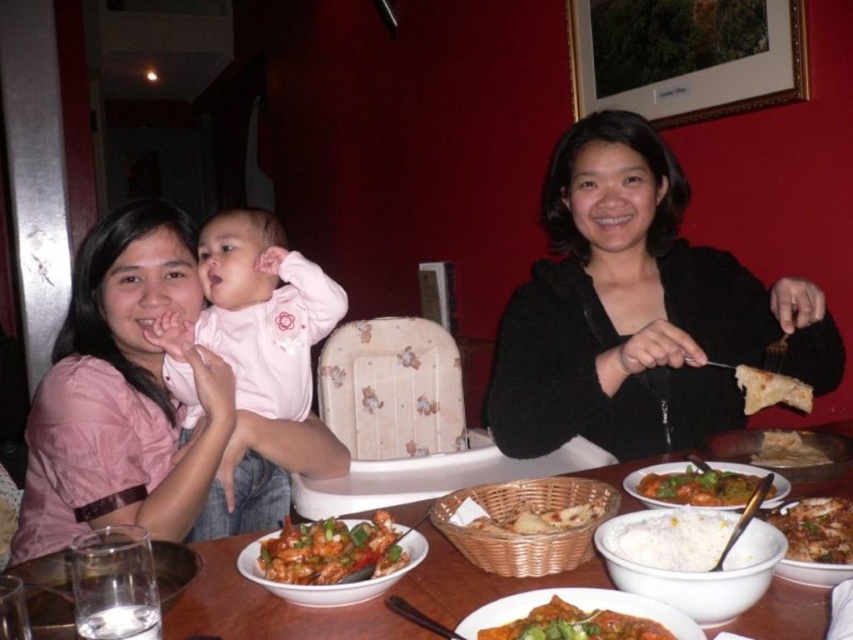
You are a diner sitting at the table and want to reach for the white matte rice at center and the bread basket at center. Which one is closer to you?

The white matte rice at center is located above the bread basket at center, so it is closer to you.